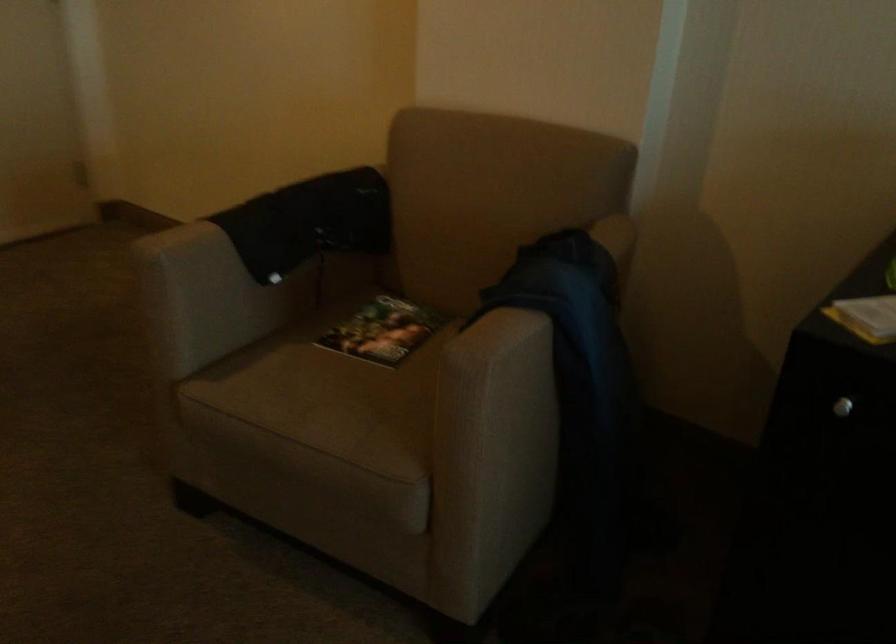
This screenshot has height=644, width=896. What do you see at coordinates (330, 404) in the screenshot?
I see `the chair sitting surface` at bounding box center [330, 404].